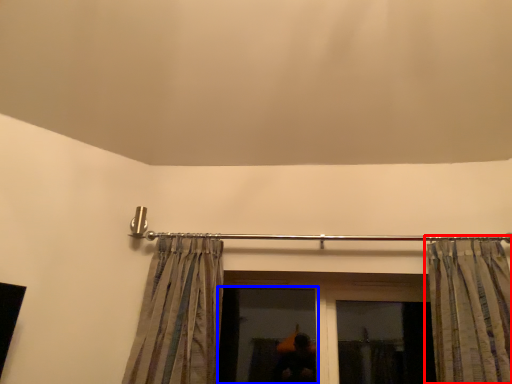
Question: Which point is closer to the camera, curtain (highlighted by a red box) or window (highlighted by a blue box)?

Choices:
 (A) curtain
 (B) window

Answer: (A)